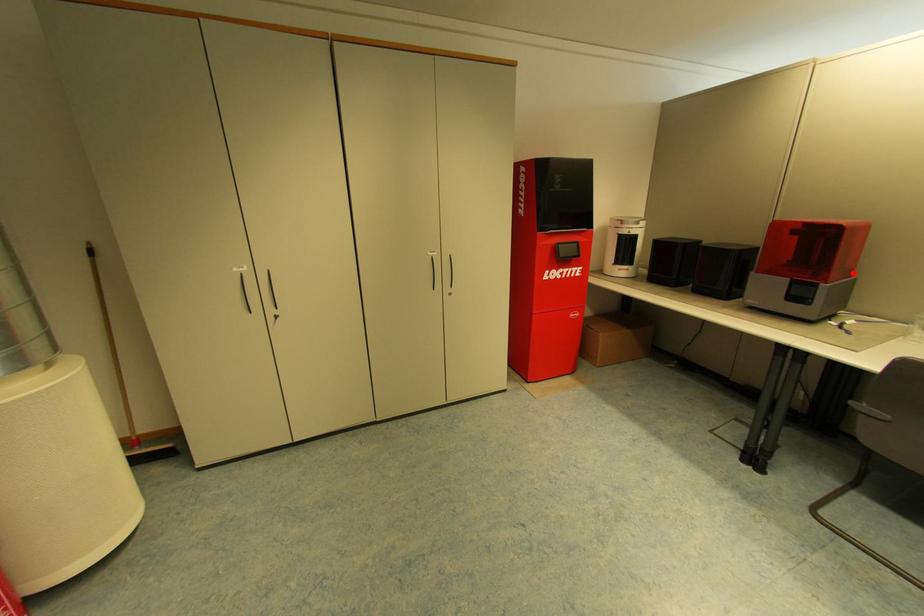
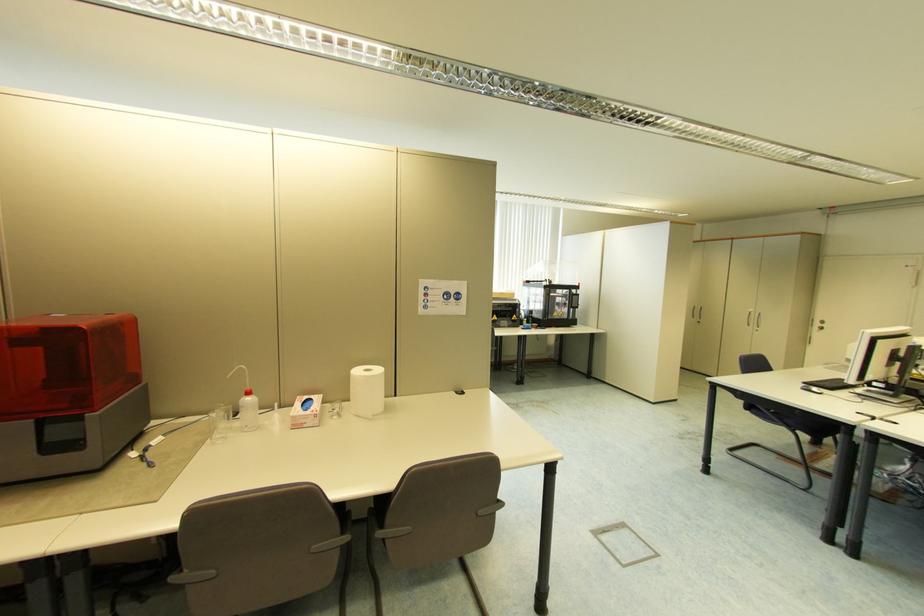
Find the pixel in the second image that matches the highlighted location in the first image.

(139, 379)